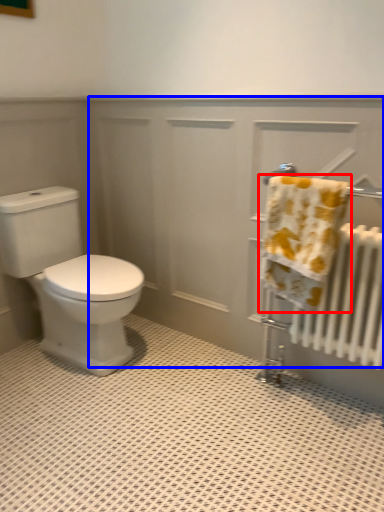
Question: Among these objects, which one is nearest to the camera, towel (highlighted by a red box) or screen door (highlighted by a blue box)?

Choices:
 (A) towel
 (B) screen door

Answer: (A)